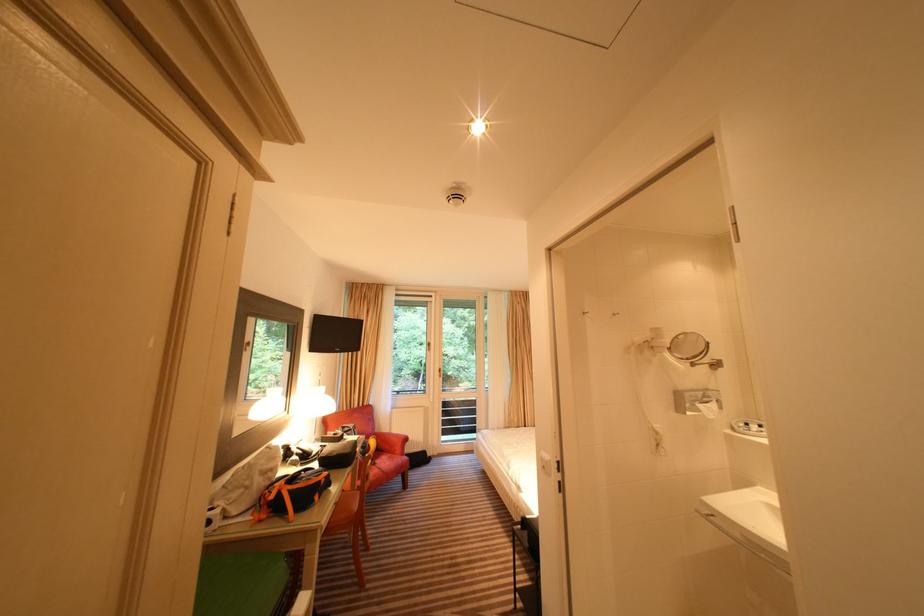
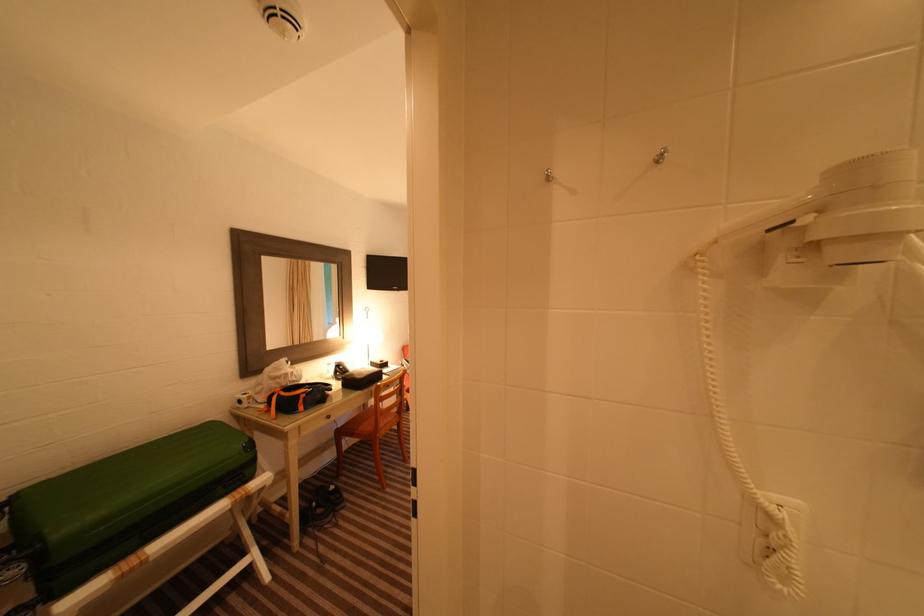
Locate, in the second image, the point that corresponds to point (286, 493) in the first image.

(280, 397)